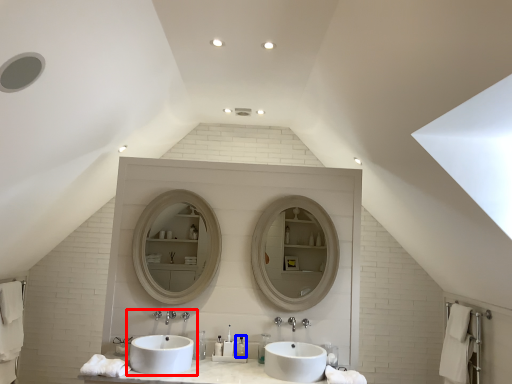
Question: Which of the following is the closest to the observer, sink (highlighted by a red box) or toiletry (highlighted by a blue box)?

Choices:
 (A) sink
 (B) toiletry

Answer: (A)